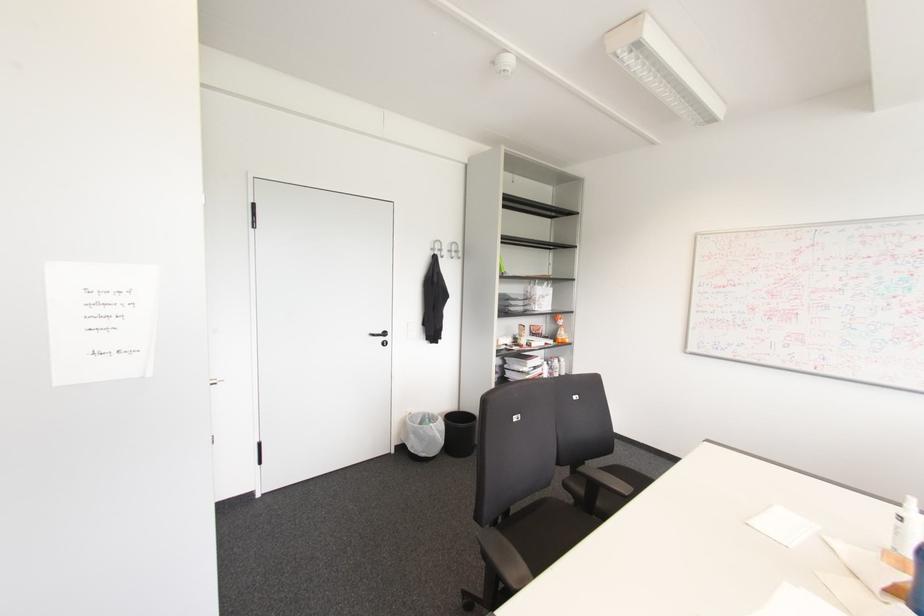
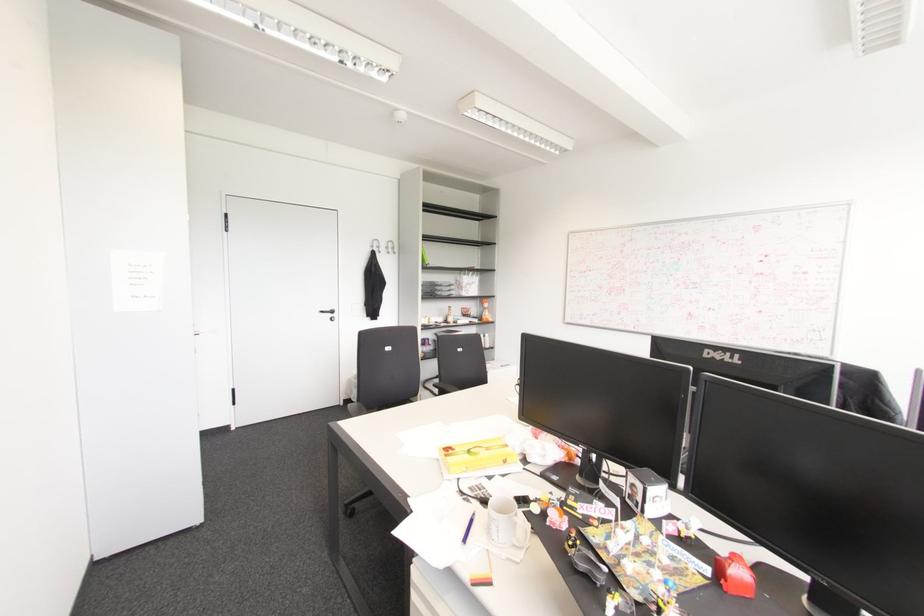
Locate, in the second image, the point that corresponds to [432,249] in the first image.

(371, 246)